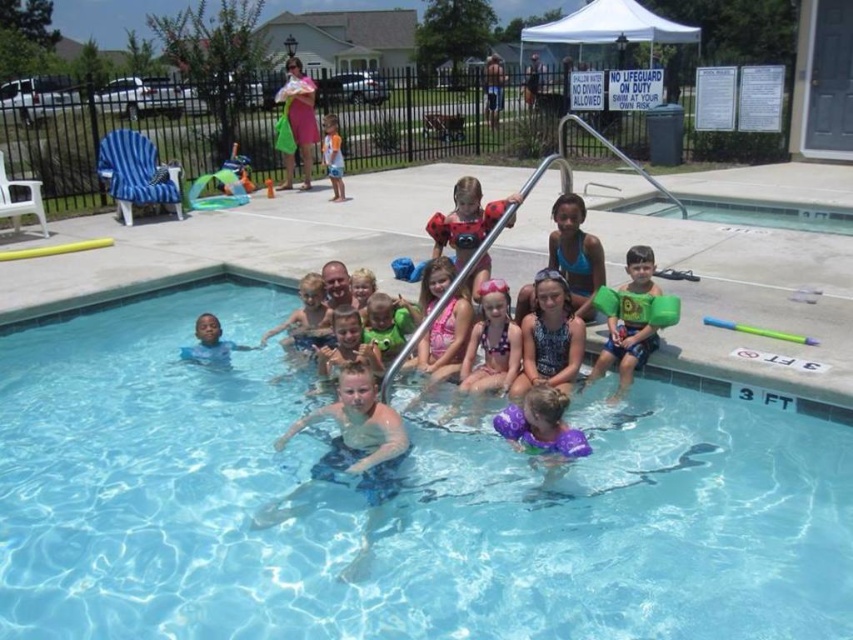
Question: Which of the following is the farthest from the observer?

Choices:
 (A) green foam arm bands at center
 (B) light brown wooden float at center

Answer: (B)

Question: Which point is farther from the camera taking this photo?

Choices:
 (A) (283, 340)
 (B) (642, 346)
 (C) (386, 348)
 (D) (549, 365)

Answer: (A)

Question: Which point is farther to the camera?

Choices:
 (A) (302, 352)
 (B) (548, 332)
 (C) (630, 284)
 (D) (323, 371)

Answer: (A)

Question: Can you confirm if clear blue water at center is positioned to the right of blue printed swimsuit at center?

Choices:
 (A) no
 (B) yes

Answer: (A)

Question: Is blue swim trunks at center to the right of green rubber float at center from the viewer's perspective?

Choices:
 (A) no
 (B) yes

Answer: (A)

Question: Observing the image, what is the correct spatial positioning of light brown wooden float at center in reference to orange fabric shirt at upper center?

Choices:
 (A) left
 (B) right

Answer: (B)